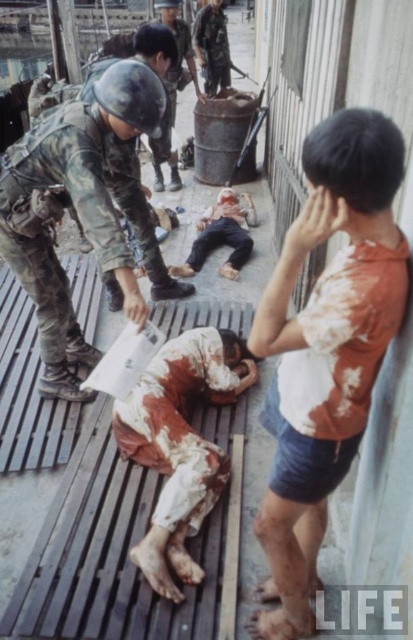
Question: Which point appears farthest from the camera in this image?

Choices:
 (A) (156, 188)
 (B) (59, 328)

Answer: (A)

Question: Based on their relative distances, which object is farther from the dirty orange shirt at right?

Choices:
 (A) camouflage fabric uniform at center
 (B) camouflage fabric soldier at center
 (C) camouflage uniform at center

Answer: (A)

Question: Does camouflage fabric soldier at center have a greater width compared to camouflage uniform at center?

Choices:
 (A) no
 (B) yes

Answer: (B)

Question: Among these objects, which one is farthest from the camera?

Choices:
 (A) camouflage uniform at center
 (B) dirty orange shirt at right
 (C) camouflage fabric uniform at center
 (D) camouflage fabric soldier at center

Answer: (C)

Question: Does camouflage uniform at center appear on the right side of camouflage fabric uniform at center?

Choices:
 (A) no
 (B) yes

Answer: (A)

Question: Can you confirm if dirty orange shirt at right is positioned to the right of camouflage fabric uniform at center?

Choices:
 (A) yes
 (B) no

Answer: (A)